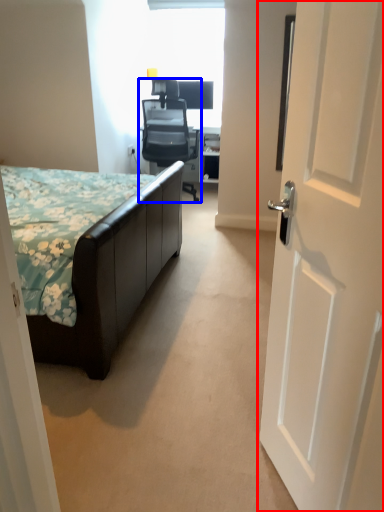
Question: Among these objects, which one is farthest to the camera, door (highlighted by a red box) or chair (highlighted by a blue box)?

Choices:
 (A) door
 (B) chair

Answer: (B)